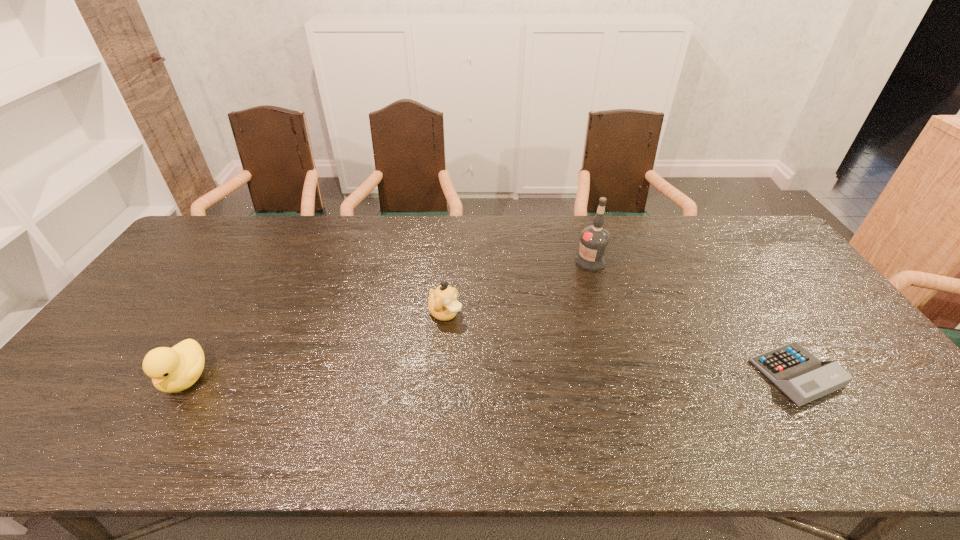
This screenshot has height=540, width=960. Find the location of `the leftmost object`. the leftmost object is located at coordinates (175, 369).

I want to click on the rightmost object, so click(801, 376).

The width and height of the screenshot is (960, 540). I want to click on the shortest object, so click(x=801, y=376).

Identify the location of the third object from right to left. (443, 305).

At what (x,y) coordinates should I click in order to perform the action: click on the second farthest object. Please return your answer as a coordinate pair (x, y). Looking at the image, I should click on (443, 305).

Find the location of a particular element. This screenshot has height=540, width=960. the third object from left to right is located at coordinates pyautogui.click(x=594, y=240).

The height and width of the screenshot is (540, 960). What are the coordinates of `vodka` in the screenshot? It's located at (594, 240).

Image resolution: width=960 pixels, height=540 pixels. Find the location of `vacant space located 0.330m on the left of the rightmost object`. vacant space located 0.330m on the left of the rightmost object is located at coordinates (625, 373).

I want to click on free space located on the face of the duckling, so click(512, 362).

At what (x,y) coordinates should I click in order to perform the action: click on vacant space situated on the face of the duckling. Please return your answer as a coordinate pair (x, y). Looking at the image, I should click on (483, 342).